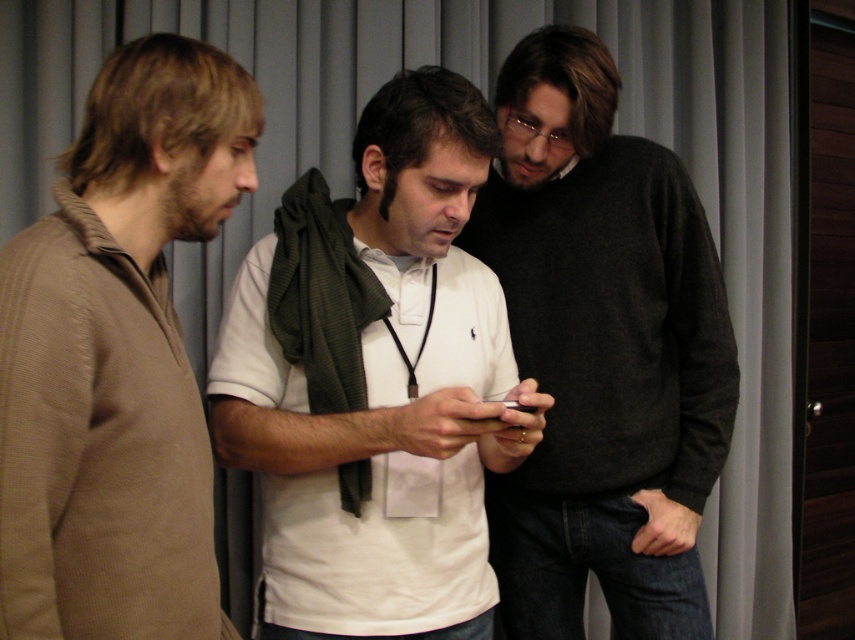
Question: Does white matte shirt at center lie behind knitted brown sweater at left?

Choices:
 (A) yes
 (B) no

Answer: (A)

Question: Is white matte shirt at center smaller than dark gray sweater at center?

Choices:
 (A) no
 (B) yes

Answer: (B)

Question: Is dark gray sweater at center closer to the viewer compared to knitted brown sweater at left?

Choices:
 (A) no
 (B) yes

Answer: (A)

Question: Which object appears farthest from the camera in this image?

Choices:
 (A) white matte shirt at center
 (B) dark gray sweater at center

Answer: (B)

Question: Among these objects, which one is farthest from the camera?

Choices:
 (A) dark gray sweater at center
 (B) knitted brown sweater at left
 (C) white matte shirt at center

Answer: (A)

Question: Which point is closer to the camera taking this photo?

Choices:
 (A) (299, 508)
 (B) (133, 70)
 (C) (653, 212)

Answer: (B)